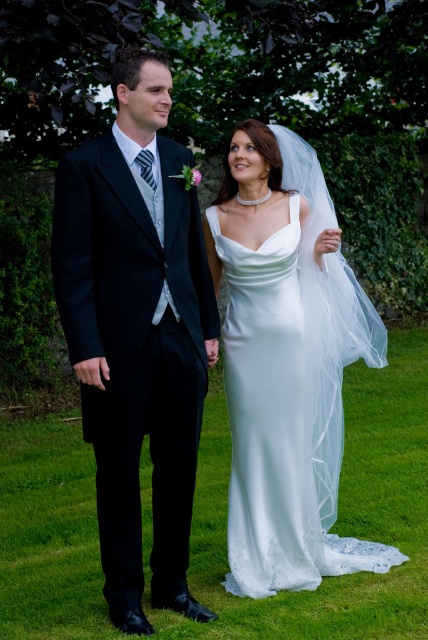
In the wedding scene, there is a matte black suit at left and a white satin dress at center. Which one is positioned more to the left side of the image?

The matte black suit at left is positioned more to the left side of the image than the white satin dress at center.

You are a photographer at a wedding. You need to ensure that the matte black suit at left and the green grass at center are both visible in your shot. Based on their positions, which object is covering part of the other?

The matte black suit at left is positioned over green grass at center, so it is covering part of the green grass at center.

You are a photographer positioned behind the couple. You want to ensure that both the matte black suit at left and the white satin dress at center are in focus. Given that your camera has a depth of field that can cover 22 inches, will both subjects be in focus?

The matte black suit at left is 21.97 inches away from the white satin dress at center. Since the distance between them is within the camera s 22 inch depth of field, both subjects will be in focus.